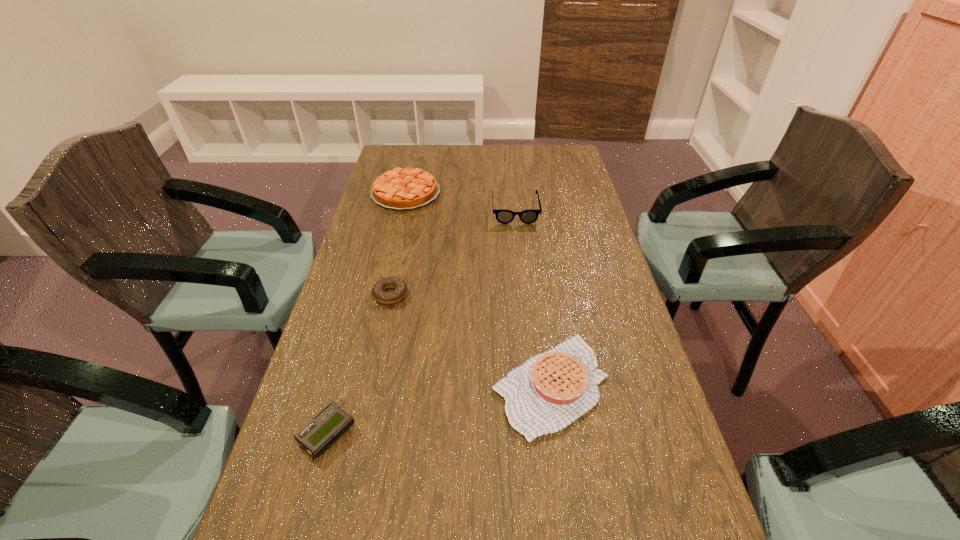
Identify the location of the tallest object. Image resolution: width=960 pixels, height=540 pixels. (502, 216).

At what (x,y) coordinates should I click in order to perform the action: click on the farther pie. Please return your answer as a coordinate pair (x, y). This screenshot has width=960, height=540. Looking at the image, I should click on (407, 188).

Where is `the right pie`? the right pie is located at coordinates (548, 392).

At what (x,y) coordinates should I click in order to perform the action: click on doughnut. Please return your answer as a coordinate pair (x, y). The image size is (960, 540). Looking at the image, I should click on (378, 291).

Locate an element on the screen. This screenshot has height=540, width=960. beeper is located at coordinates (325, 427).

You are a GUI agent. You are given a task and a screenshot of the screen. Output one action in this format:
    pyautogui.click(x=<x>, y=<y>)
    Task: Click on the free space located on the arms of the tallest object
    The width and height of the screenshot is (960, 540).
    Given the screenshot: What is the action you would take?
    pyautogui.click(x=519, y=252)

In order to click on free location located 0.180m on the right of the farther pie in this screenshot , I will do `click(492, 193)`.

This screenshot has height=540, width=960. Find the location of `vacant space situated on the back of the right pie`. vacant space situated on the back of the right pie is located at coordinates (530, 239).

The height and width of the screenshot is (540, 960). What are the coordinates of `free spot located 0.080m on the right of the doughnut` in the screenshot? It's located at (439, 294).

Find the location of `free spot located on the back of the beeper`. free spot located on the back of the beeper is located at coordinates (352, 340).